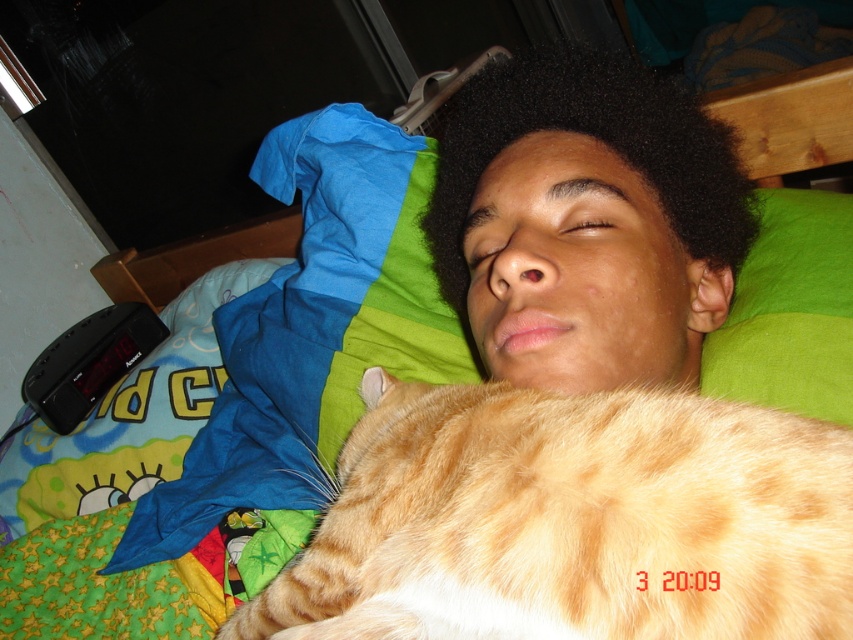
Question: Considering the relative positions of orange fur cat at center and black curly hair at center in the image provided, where is orange fur cat at center located with respect to black curly hair at center?

Choices:
 (A) right
 (B) left

Answer: (B)

Question: Which point appears farthest from the camera in this image?

Choices:
 (A) (566, 368)
 (B) (274, 604)

Answer: (A)

Question: Can you confirm if orange fur cat at center is wider than black curly hair at center?

Choices:
 (A) yes
 (B) no

Answer: (A)

Question: Which point is farther to the camera?

Choices:
 (A) black curly hair at center
 (B) orange fur cat at center

Answer: (A)

Question: Does orange fur cat at center appear over black curly hair at center?

Choices:
 (A) no
 (B) yes

Answer: (A)